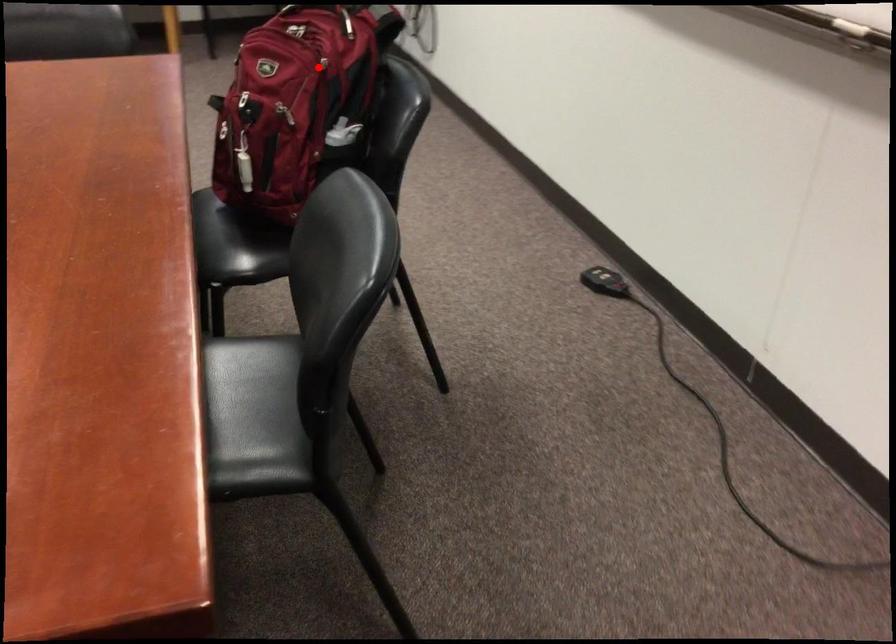
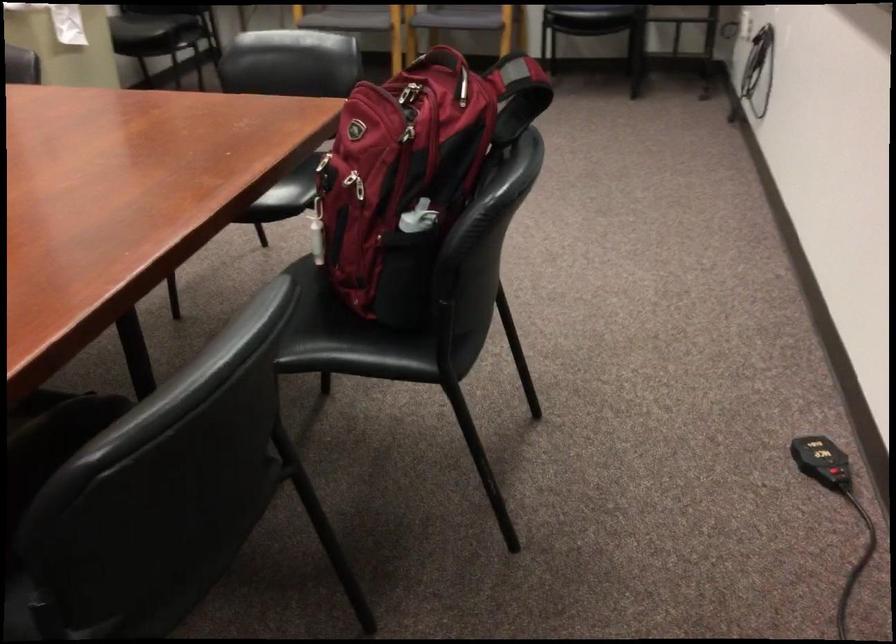
Question: I am providing you with two images of the same scene from different viewpoints. Image1 has a red point marked. In image2, the corresponding 3D location appears at what relative position? Reply with the corresponding letter.

Choices:
 (A) Closer
 (B) Farther

Answer: (A)